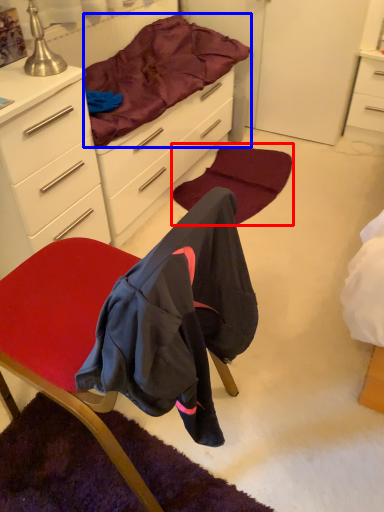
Question: Which object appears closest to the camera in this image, mat (highlighted by a red box) or bedding (highlighted by a blue box)?

Choices:
 (A) mat
 (B) bedding

Answer: (B)